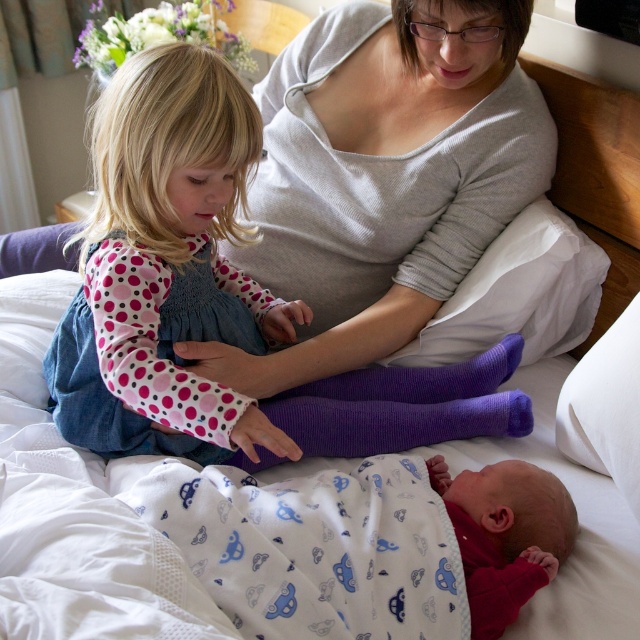
Is point (228, 90) positioned behind point (406, 385)?

No, it is in front of (406, 385).

You are a GUI agent. You are given a task and a screenshot of the screen. Output one action in this format:
    pyautogui.click(x=<x>, y=<y>)
    Task: Click on the denim dress at upper left
    The height and width of the screenshot is (640, 640).
    Given the screenshot: What is the action you would take?
    pyautogui.click(x=166, y=269)

Locate an element on the screen. denim dress at upper left is located at coordinates [166, 269].

Can you confirm if denim dress at upper left is positioned to the left of white cotton swaddle at lower center?

Yes, denim dress at upper left is to the left of white cotton swaddle at lower center.

In the scene shown: Is denim dress at upper left bigger than white cotton swaddle at lower center?

Indeed, denim dress at upper left has a larger size compared to white cotton swaddle at lower center.

Is point (134, 314) closer to camera compared to point (320, 481)?

That is True.

Find the location of a particular element. Image resolution: width=640 pixels, height=640 pixels. denim dress at upper left is located at coordinates (166, 269).

How distant is purple ribbed sock at center from purple knitted sock at center?

purple ribbed sock at center and purple knitted sock at center are 1.44 inches apart from each other.

Between point (312, 419) and point (392, 381), which one is positioned in front?

Positioned in front is point (312, 419).

You are a GUI agent. You are given a task and a screenshot of the screen. Output one action in this format:
    pyautogui.click(x=<x>, y=<y>)
    Task: Click on the purple ribbed sock at center
    This screenshot has height=640, width=640.
    Given the screenshot: What is the action you would take?
    pyautogui.click(x=392, y=416)